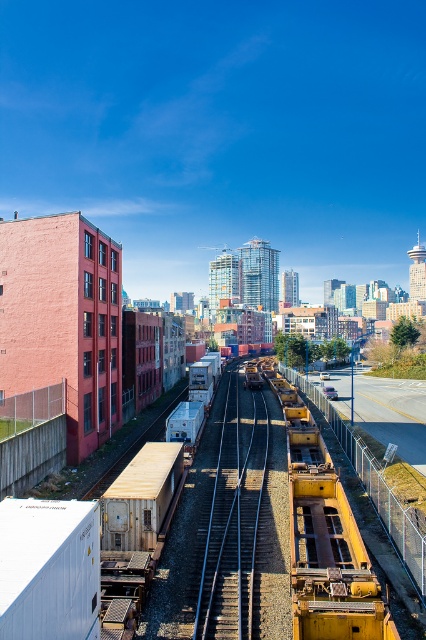
Is rusty metal train car at center below metallic silver train track at center?

Actually, rusty metal train car at center is above metallic silver train track at center.

Measure the distance between point (293, 557) and camera.

Point (293, 557) is 57.45 feet from camera.

What do you see at coordinates (325, 541) in the screenshot? Image resolution: width=426 pixels, height=640 pixels. I see `rusty metal train car at center` at bounding box center [325, 541].

Where is `rusty metal train car at center`? The height and width of the screenshot is (640, 426). rusty metal train car at center is located at coordinates (325, 541).